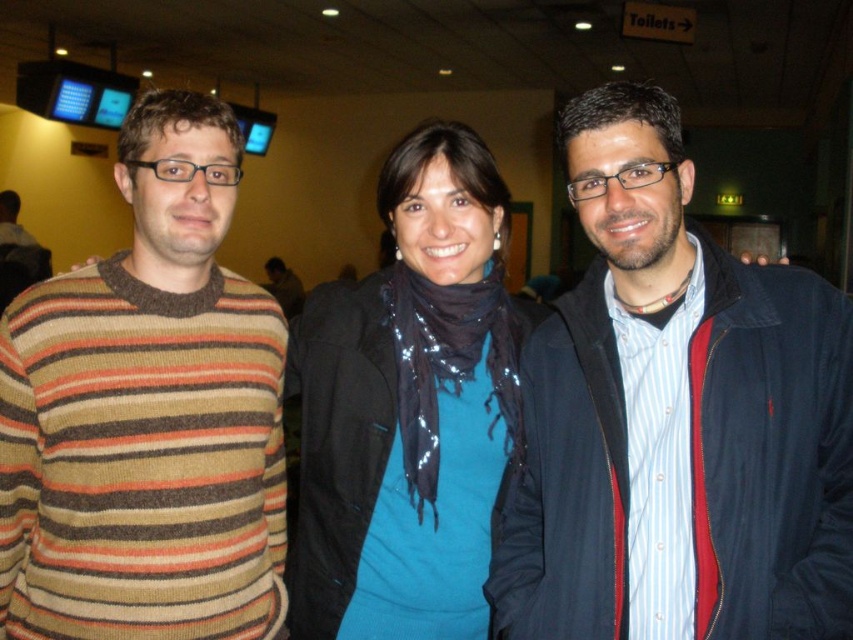
Who is taller, dark blue jacket at center or striped knit sweater at left?

With more height is striped knit sweater at left.

Does dark blue jacket at center have a greater width compared to striped knit sweater at left?

Yes.

What do you see at coordinates (675, 419) in the screenshot? I see `dark blue jacket at center` at bounding box center [675, 419].

You are a GUI agent. You are given a task and a screenshot of the screen. Output one action in this format:
    pyautogui.click(x=<x>, y=<y>)
    Task: Click on the dark blue jacket at center
    This screenshot has height=640, width=853.
    Given the screenshot: What is the action you would take?
    pyautogui.click(x=675, y=419)

Who is positioned more to the right, striped knit sweater at left or blue sequined scarf at center?

Positioned to the right is blue sequined scarf at center.

Measure the distance between striped knit sweater at left and camera.

striped knit sweater at left and camera are 4.22 feet apart.

This screenshot has height=640, width=853. Identify the location of striped knit sweater at left. (148, 413).

Is dark blue jacket at center shorter than blue sequined scarf at center?

Yes, dark blue jacket at center is shorter than blue sequined scarf at center.

Can you confirm if dark blue jacket at center is positioned to the right of blue sequined scarf at center?

Correct, you'll find dark blue jacket at center to the right of blue sequined scarf at center.

At what (x,y) coordinates should I click in order to perform the action: click on dark blue jacket at center. Please return your answer as a coordinate pair (x, y). This screenshot has height=640, width=853. Looking at the image, I should click on coord(675,419).

Find the location of a particular element. dark blue jacket at center is located at coordinates (675, 419).